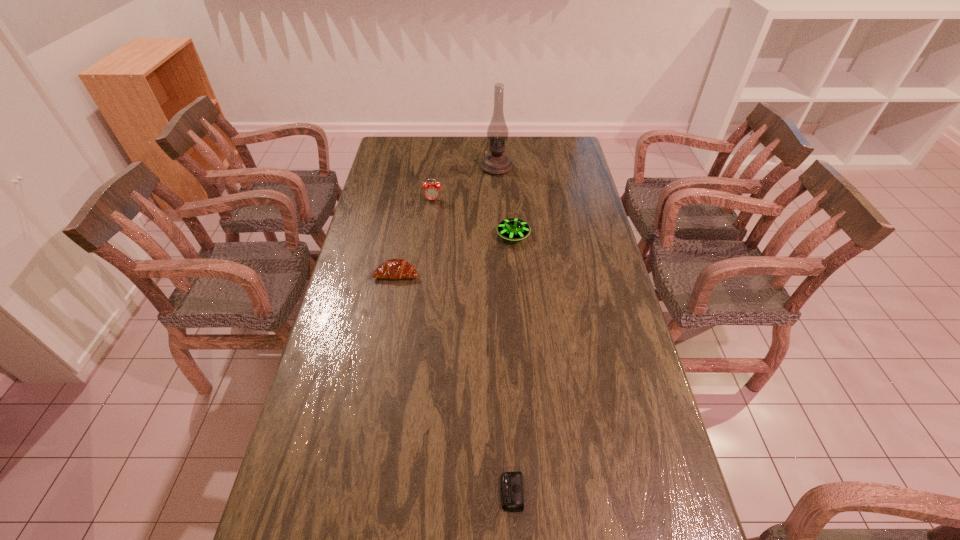
Identify the location of free region located 0.240m on the right of the tallest object. Image resolution: width=960 pixels, height=540 pixels. (566, 167).

What are the coordinates of `vacant space located 0.340m on the face of the farther alarm clock` in the screenshot? It's located at (425, 261).

Identify the location of free spot located 0.070m on the left of the saucer. (478, 236).

The width and height of the screenshot is (960, 540). In order to click on vacant space located on the front of the second nearest object in this screenshot , I will do `click(385, 338)`.

This screenshot has height=540, width=960. I want to click on free location located 0.150m on the display of the nearer alarm clock, so click(436, 492).

Locate an element on the screen. The height and width of the screenshot is (540, 960). vacant region located on the display of the nearer alarm clock is located at coordinates (432, 492).

This screenshot has height=540, width=960. I want to click on vacant space situated 0.110m on the display of the nearer alarm clock, so click(453, 492).

Find the location of a particular element. Image resolution: width=960 pixels, height=540 pixels. object that is at the far edge is located at coordinates (495, 163).

Image resolution: width=960 pixels, height=540 pixels. Identify the location of object that is at the left edge. (393, 268).

This screenshot has height=540, width=960. In order to click on vacant space at the far edge of the desktop in this screenshot , I will do `click(438, 154)`.